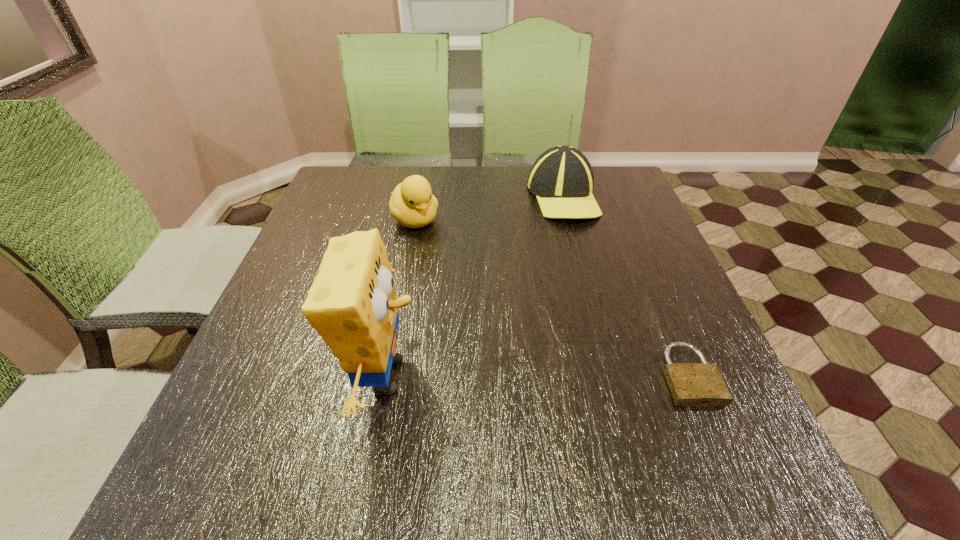
Identify the location of the tallest object. (352, 304).

Image resolution: width=960 pixels, height=540 pixels. Identify the location of padlock. (691, 384).

This screenshot has height=540, width=960. I want to click on the shortest object, so click(691, 384).

Identify the location of the second object from right to left. The height and width of the screenshot is (540, 960). pos(562,179).

This screenshot has width=960, height=540. I want to click on baseball cap, so click(562, 179).

I want to click on duck, so click(x=412, y=204).

Locate an element on the screen. Image resolution: width=960 pixels, height=540 pixels. blank space located 0.260m on the face of the sponge is located at coordinates (564, 376).

Find the location of `free region located 0.050m on the keyhole side of the rightmost object`. free region located 0.050m on the keyhole side of the rightmost object is located at coordinates (713, 434).

You are a GUI agent. You are given a task and a screenshot of the screen. Output one action in this format:
    pyautogui.click(x=<x>, y=<y>)
    Task: Click on the vacant space located 0.240m with the brim of the second object from right to left facing forward
    The height and width of the screenshot is (540, 960).
    Given the screenshot: What is the action you would take?
    pyautogui.click(x=568, y=288)

Identify the location of vacant point located with the brim of the second object from right to left facing forward. (567, 273).